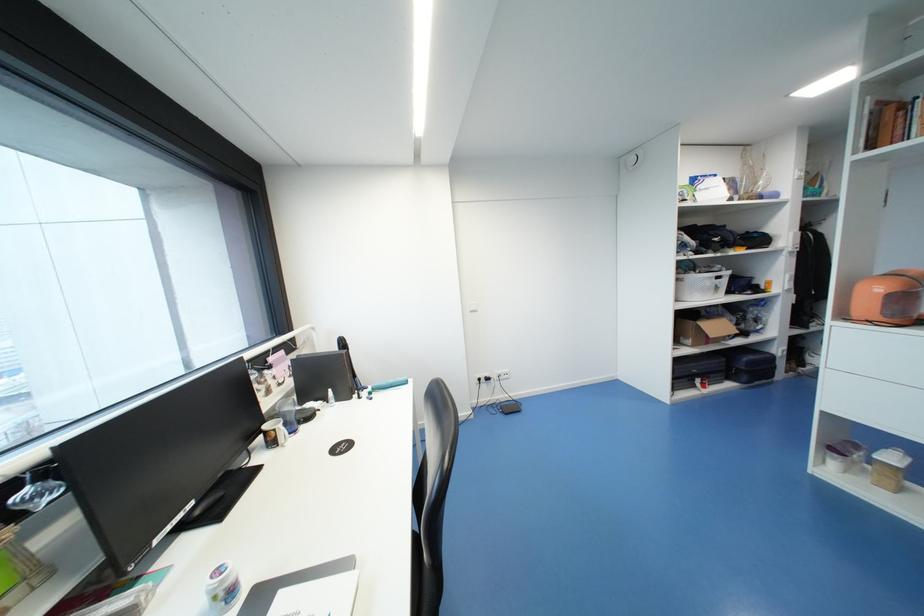
You are a GUI agent. You are given a task and a screenshot of the screen. Output one action in this format:
    pyautogui.click(x=<x>, y=<y>)
    Task: Click on the cardboard box
    
    Given the screenshot: What is the action you would take?
    pyautogui.click(x=701, y=331)